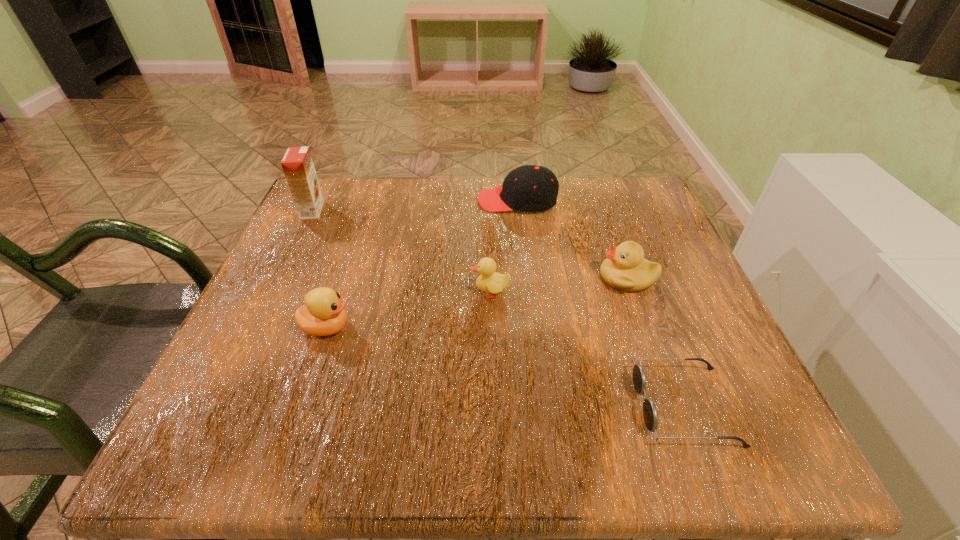
Find the location of a particular element. object present at the far left corner is located at coordinates (297, 164).

Identify the location of object that is at the near right corner. This screenshot has width=960, height=540. (650, 415).

This screenshot has height=540, width=960. I want to click on vacant space at the far edge of the desktop, so click(x=564, y=192).

In the image, there is a desktop. Identify the location of vacant area at the near edge. (548, 427).

At what (x,y) coordinates should I click in order to perform the action: click on vacant region at the left edge of the desktop. Please return your answer as a coordinate pair (x, y). Looking at the image, I should click on (287, 344).

The image size is (960, 540). In the image, there is a desktop. What are the coordinates of `vacant space at the right edge` in the screenshot? It's located at (718, 323).

The width and height of the screenshot is (960, 540). I want to click on vacant region at the far left corner, so click(345, 217).

The image size is (960, 540). I want to click on free space at the near left corner of the desktop, so click(x=233, y=426).

Locate an element on the screen. free space at the far right corner is located at coordinates (621, 204).

The height and width of the screenshot is (540, 960). In the image, there is a desktop. Identify the location of free space at the near right corner. point(666,418).